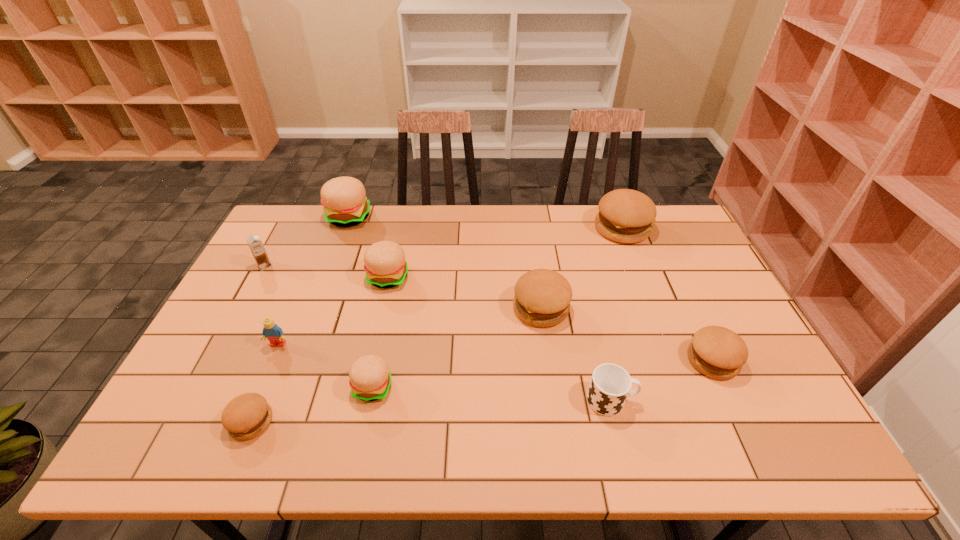
In the image, there is a desktop. Where is `free space at the left edge`? The image size is (960, 540). free space at the left edge is located at coordinates (232, 375).

The width and height of the screenshot is (960, 540). I want to click on vacant space at the right edge of the desktop, so click(x=755, y=353).

In the image, there is a desktop. Identify the location of vacant region at the far left corner. The width and height of the screenshot is (960, 540). (283, 229).

This screenshot has height=540, width=960. In order to click on free point at the near left corner in this screenshot , I will do coord(163,453).

Find the location of a particular element. free space at the near right corner of the desktop is located at coordinates (773, 425).

You are a GUI agent. You are given a task and a screenshot of the screen. Output one action in this format:
    pyautogui.click(x=<x>, y=<y>)
    Task: Click on the empty location between the smallest beige hamburger and the chocolate milk
    The image size is (960, 540).
    Given the screenshot: What is the action you would take?
    pyautogui.click(x=319, y=327)

Locate an element on the screen. free space between the leftmost object and the smallest beige hamburger is located at coordinates (319, 327).

Where is `free area in between the Lego and the nearest beige hamburger`? free area in between the Lego and the nearest beige hamburger is located at coordinates (325, 366).

Where is `free space between the leftmost brown hamburger and the second nearest brown hamburger`? free space between the leftmost brown hamburger and the second nearest brown hamburger is located at coordinates (482, 391).

Where is `free space between the leftmost object and the Lego`? This screenshot has width=960, height=540. free space between the leftmost object and the Lego is located at coordinates (272, 305).